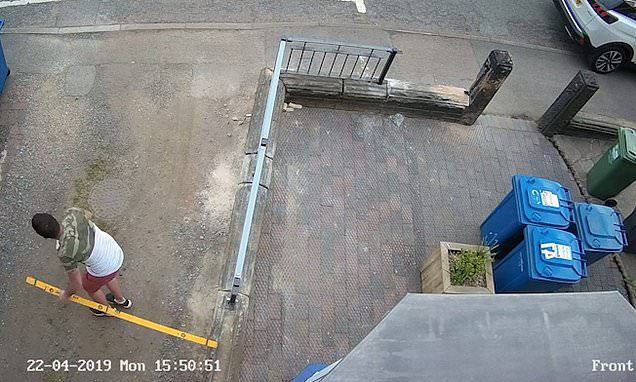
Where is `plant`? Image resolution: width=636 pixels, height=382 pixels. plant is located at coordinates (474, 264).